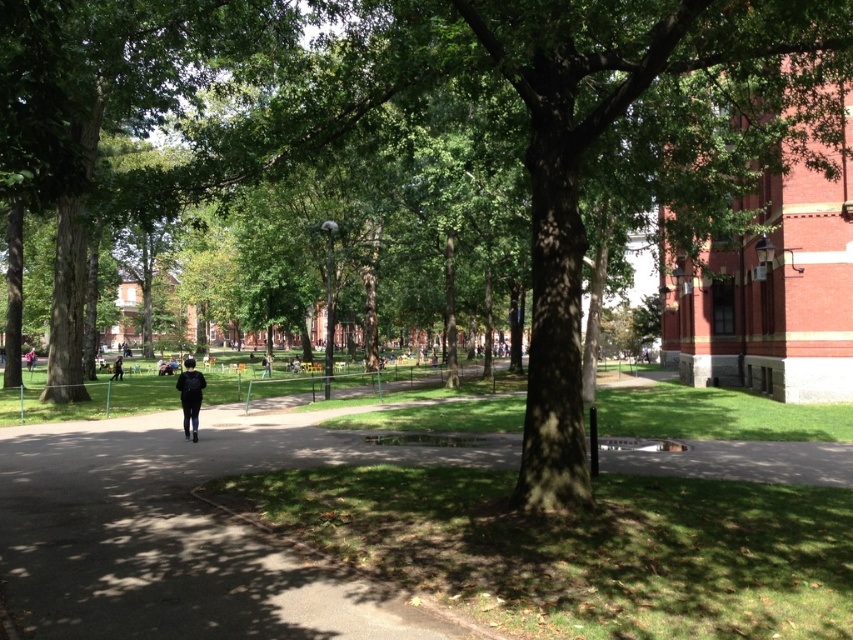
Question: Does dark blue jeans at center have a lesser width compared to black backpack at center?

Choices:
 (A) no
 (B) yes

Answer: (A)

Question: Which point appears farthest from the camera in this image?

Choices:
 (A) (270, 376)
 (B) (201, 374)

Answer: (A)

Question: Which of the following is the farthest from the observer?

Choices:
 (A) (265, 372)
 (B) (120, 355)

Answer: (B)

Question: Which of the following is the closest to the observer?

Choices:
 (A) (265, 358)
 (B) (113, 371)
 (C) (195, 401)

Answer: (C)

Question: Does black fabric backpack at center appear under black backpack at center?

Choices:
 (A) yes
 (B) no

Answer: (B)

Question: Is dark blue jeans at center closer to camera compared to black fabric backpack at center?

Choices:
 (A) yes
 (B) no

Answer: (A)